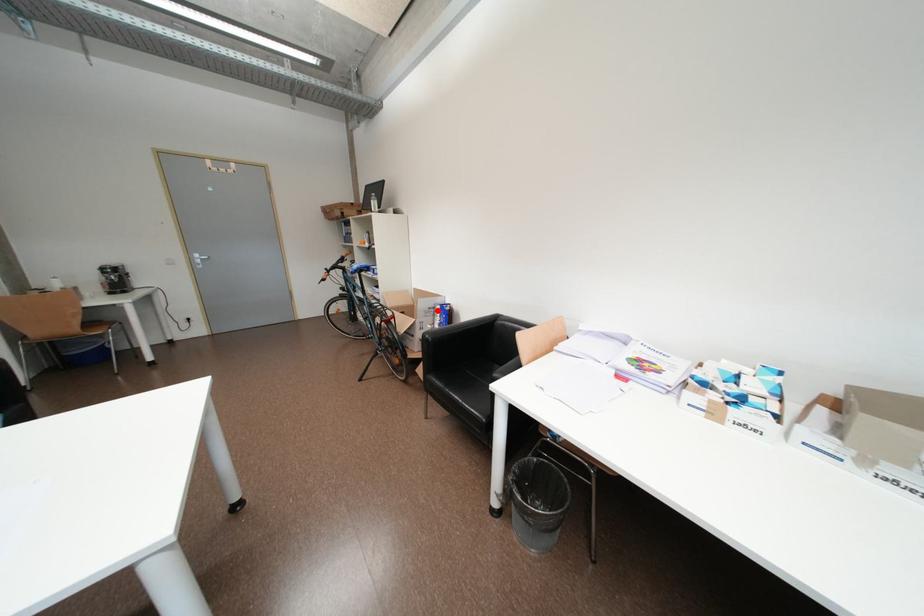
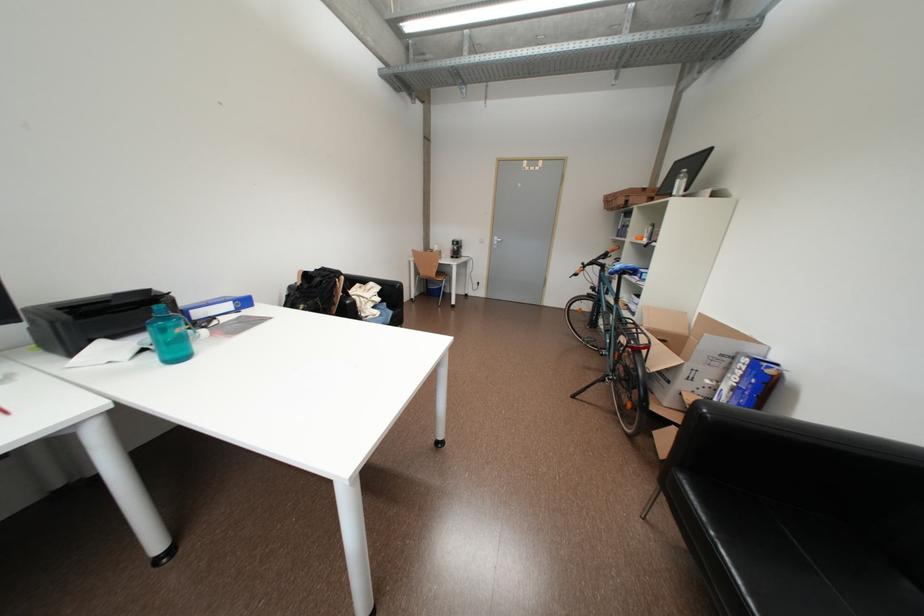
Question: I am providing you with two images of the same scene from different viewpoints. Image1 has a red point marked. In image2, the corresponding 3D location appears at what relative position? Reply with the corresponding letter.

Choices:
 (A) Closer
 (B) Farther

Answer: (A)